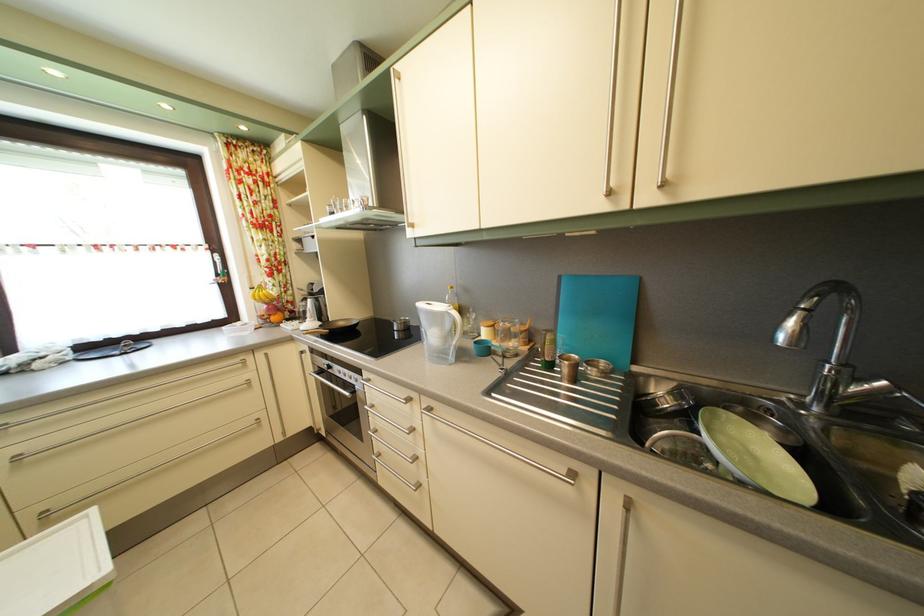
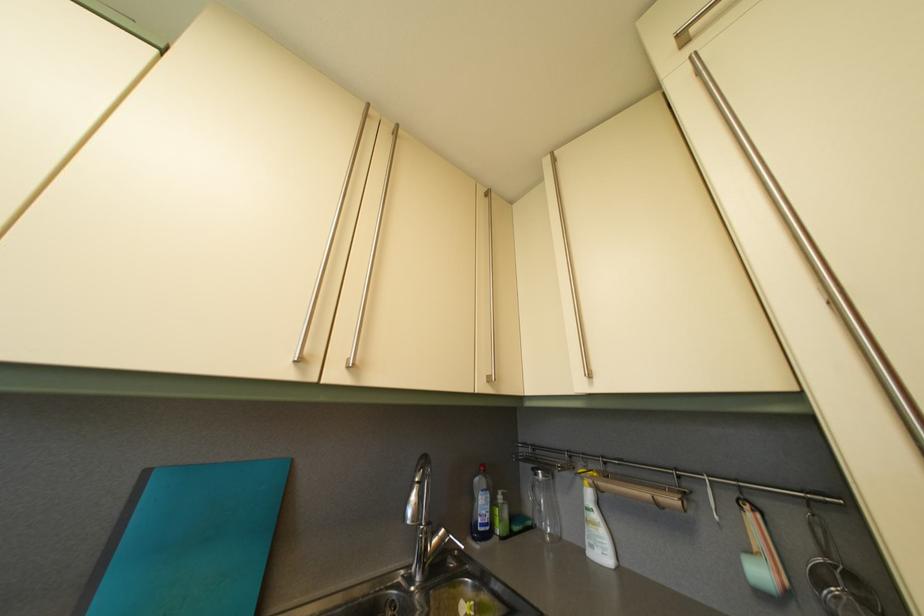
Locate, in the second image, the point that corresponds to [893,391] in the first image.

(451, 539)